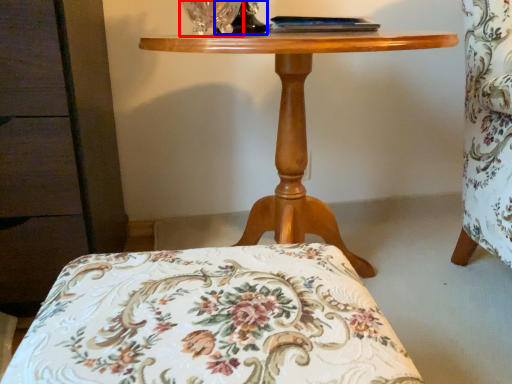
Question: Which point is further to the camera, glass vase (highlighted by a red box) or table lamp (highlighted by a blue box)?

Choices:
 (A) glass vase
 (B) table lamp

Answer: (B)